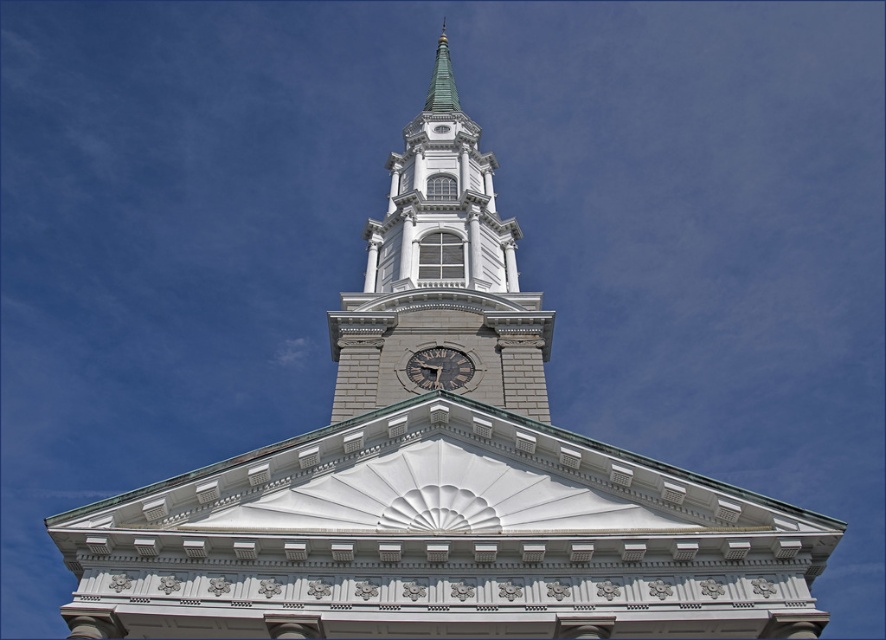
Question: Which point is closer to the camera taking this photo?

Choices:
 (A) (410, 362)
 (B) (409, 321)

Answer: (A)

Question: Is white stone clock tower at center bigger than dark brown wooden clock at center?

Choices:
 (A) yes
 (B) no

Answer: (A)

Question: Is white stone clock tower at center positioned behind dark brown wooden clock at center?

Choices:
 (A) no
 (B) yes

Answer: (A)

Question: Which point is closer to the camera?

Choices:
 (A) white stone clock tower at center
 (B) dark brown wooden clock at center

Answer: (A)

Question: Where is white stone clock tower at center located in relation to dark brown wooden clock at center in the image?

Choices:
 (A) above
 (B) below

Answer: (A)